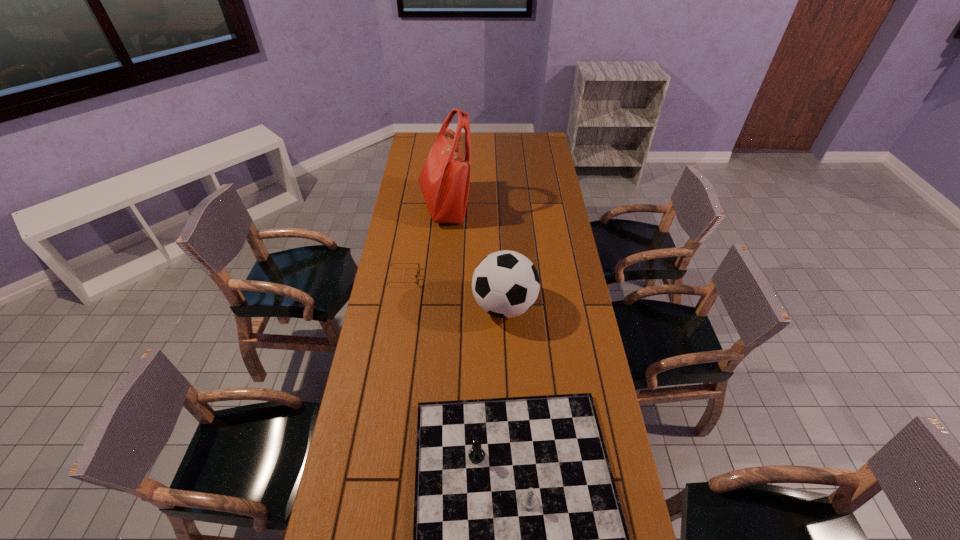
Identify the location of vacant region at the right edge of the desktop. The width and height of the screenshot is (960, 540). (546, 218).

Identify the location of blank space at the far right corner of the desktop. (548, 147).

The width and height of the screenshot is (960, 540). I want to click on vacant area between the handbag and the soccer ball, so (474, 256).

This screenshot has height=540, width=960. In order to click on vacant point located between the sunglasses and the tallest object in this screenshot , I will do `click(424, 242)`.

This screenshot has width=960, height=540. What are the coordinates of `vacant space that's between the tallest object and the second tallest object` in the screenshot? It's located at (474, 256).

Locate an element on the screen. The image size is (960, 540). free spot between the second tallest object and the farthest object is located at coordinates (474, 256).

Find the location of a particular element. The image size is (960, 540). free point between the farthest object and the shortest object is located at coordinates (424, 242).

Point out which object is positioned as the second nearest to the sunglasses. Please provide its 2D coordinates. Your answer should be formatted as a tuple, i.e. [(x, y)], where the tuple contains the x and y coordinates of a point satisfying the conditions above.

[(445, 177)]

What are the coordinates of `object that ranks as the closest to the soccer ball` in the screenshot? It's located at (416, 276).

Image resolution: width=960 pixels, height=540 pixels. Find the location of `free location that satisfies the following two spatial constraints: 1. on the front-facing side of the handbag; 2. on the right side of the third shortest object`. free location that satisfies the following two spatial constraints: 1. on the front-facing side of the handbag; 2. on the right side of the third shortest object is located at coordinates (436, 306).